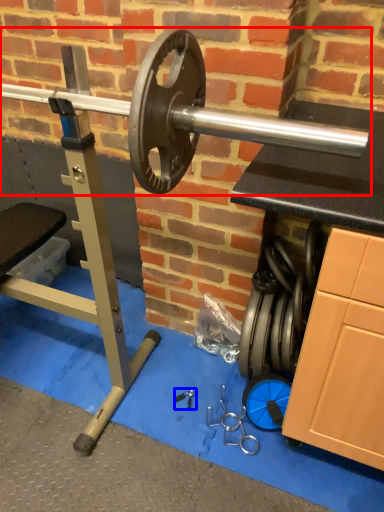
Question: Which point is closer to the camera, barbell (highlighted by a red box) or tool (highlighted by a blue box)?

Choices:
 (A) barbell
 (B) tool

Answer: (A)